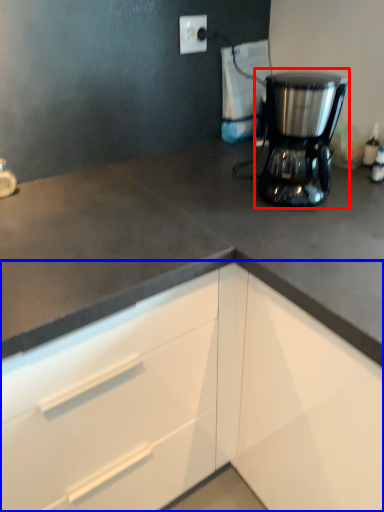
Question: Which object appears closest to the camera in this image, home appliance (highlighted by a red box) or cabinetry (highlighted by a blue box)?

Choices:
 (A) home appliance
 (B) cabinetry

Answer: (B)